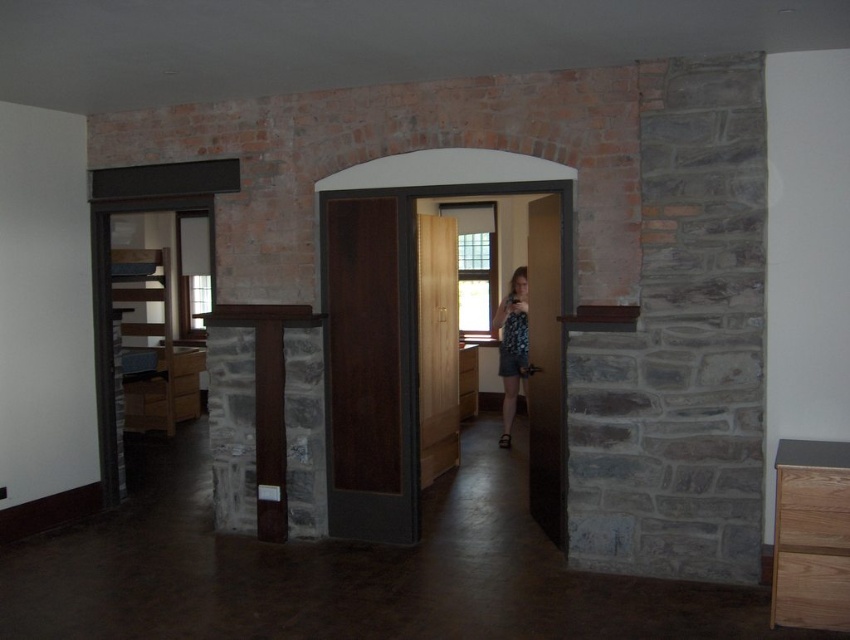
Does dark wood door at center lie behind wooden door at center?

No, it is in front of wooden door at center.

Is dark wood door at center to the right of wooden door at center from the viewer's perspective?

In fact, dark wood door at center is to the left of wooden door at center.

Is point (394, 312) positioned after point (446, 388)?

That is False.

Locate an element on the screen. dark wood door at center is located at coordinates (367, 365).

Who is more forward, (x=556, y=230) or (x=511, y=365)?

Point (x=556, y=230)

Between brown wooden door at center and printed fabric dress at center, which one is positioned lower?

printed fabric dress at center

Find the location of a particular element. brown wooden door at center is located at coordinates (545, 365).

Who is shorter, wooden door at center or printed fabric dress at center?

Standing shorter between the two is printed fabric dress at center.

Between point (442, 300) and point (503, 349), which one is positioned behind?

The point (503, 349) is more distant.

Find the location of a particular element. This screenshot has height=640, width=850. wooden door at center is located at coordinates click(437, 346).